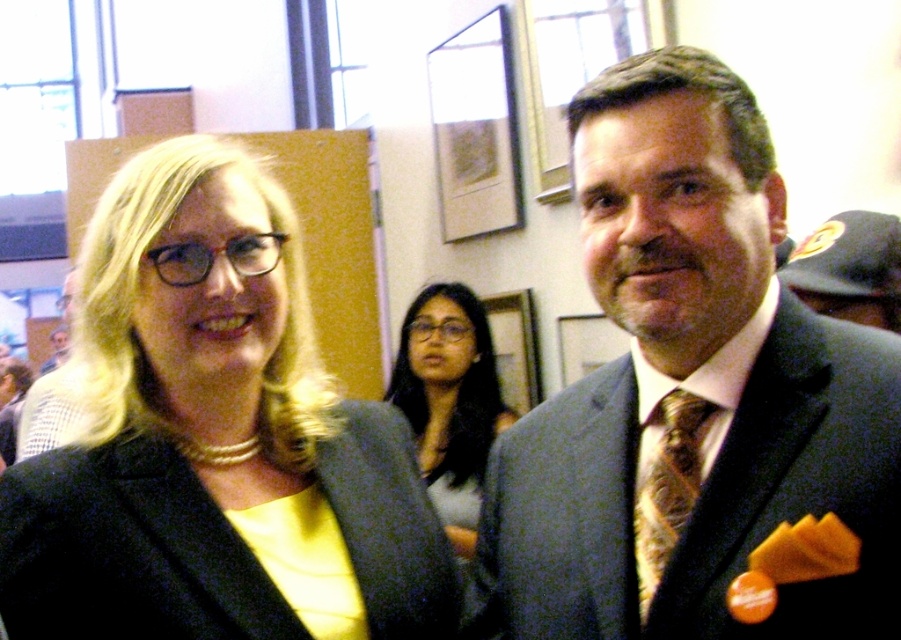
Is the position of matte gray suit at center more distant than that of gold textured tie at center?

No, it is in front of gold textured tie at center.

Is point (735, 100) behind point (694, 448)?

No, it is not.

Find the location of a particular element. This screenshot has width=901, height=640. matte gray suit at center is located at coordinates (694, 403).

Does dark blue suit at center have a greater height compared to matte black suit at center?

No.

Does dark blue suit at center have a lesser width compared to matte black suit at center?

Indeed, dark blue suit at center has a lesser width compared to matte black suit at center.

This screenshot has width=901, height=640. Describe the element at coordinates (851, 268) in the screenshot. I see `dark blue suit at center` at that location.

Identify the location of dark blue suit at center. This screenshot has height=640, width=901. (851, 268).

Describe the element at coordinates (126, 552) in the screenshot. I see `black wool blazer at center` at that location.

Can you confirm if black wool blazer at center is positioned below matte gray shirt at center?

Actually, black wool blazer at center is above matte gray shirt at center.

Does point (142, 488) come farther from viewer compared to point (478, 397)?

No, (142, 488) is in front of (478, 397).

Image resolution: width=901 pixels, height=640 pixels. What are the coordinates of `black wool blazer at center` in the screenshot? It's located at (126, 552).